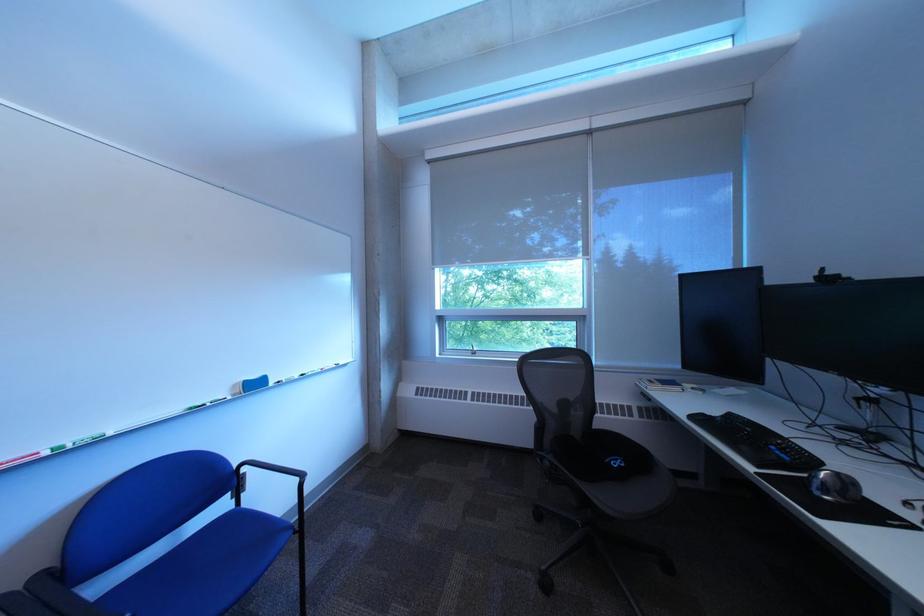
Where would you resting arm the black chair armrest? Please return your answer as a coordinate pair (x, y).

(268, 476)